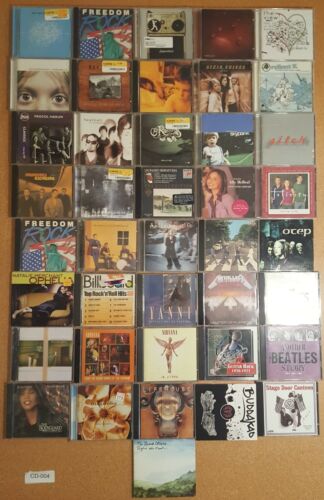
You are a GUI agent. You are given a task and a screenshot of the screen. Output one action in this format:
    pyautogui.click(x=<x>, y=<y>)
    Task: Click on the couch
    The image size is (324, 500).
    Given the screenshot: What is the action you would take?
    pyautogui.click(x=39, y=298)